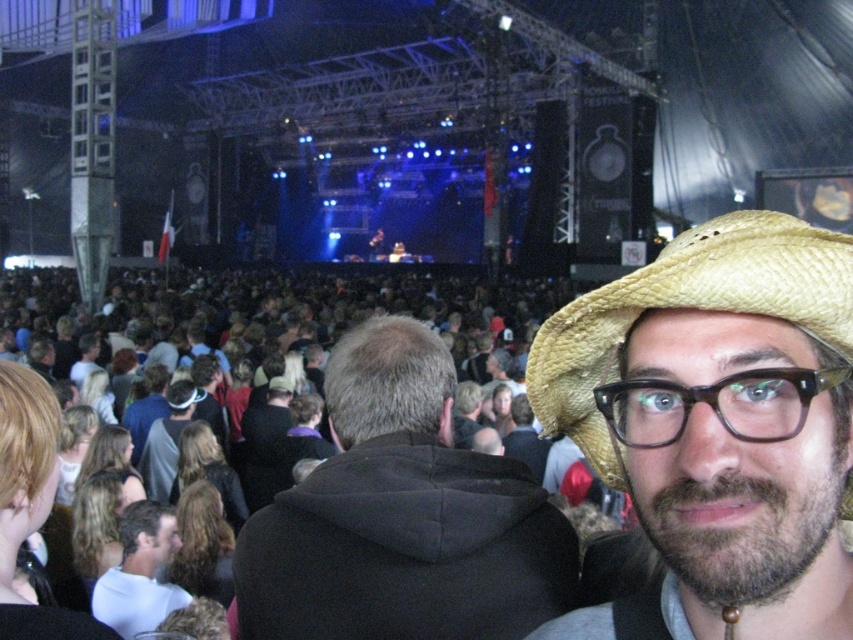
Is black fleece jacket at center further to camera compared to black plastic glasses at center?

Yes.

Locate an element on the screen. black fleece jacket at center is located at coordinates (402, 516).

Which is in front, point (157, 557) or point (517, 435)?

Positioned in front is point (157, 557).

Does white matte shirt at center lie behind dark blue hoodie at center?

That is False.

Who is more forward, (131, 576) or (514, 397)?

Positioned in front is point (131, 576).

The height and width of the screenshot is (640, 853). I want to click on white matte shirt at center, so click(x=140, y=572).

Measure the distance from black plastic glasses at center to white matte shirt at center.

black plastic glasses at center is 20.54 meters from white matte shirt at center.

Does point (635, 428) lie behind point (167, 595)?

No, (635, 428) is in front of (167, 595).

Locate an element on the screen. black plastic glasses at center is located at coordinates (715, 404).

Image resolution: width=853 pixels, height=640 pixels. I want to click on black plastic glasses at center, so click(715, 404).